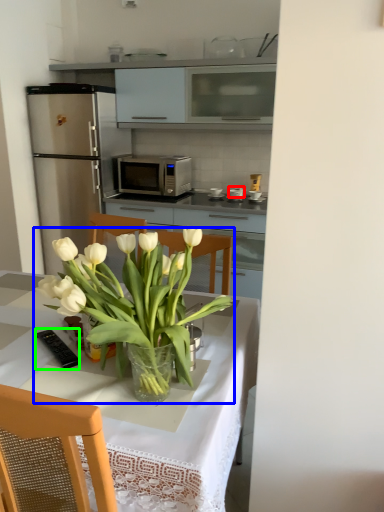
Question: Which is nearer to the appliance (highlighted by a red box)? houseplant (highlighted by a blue box) or appliance (highlighted by a green box).

Choices:
 (A) houseplant
 (B) appliance

Answer: (B)